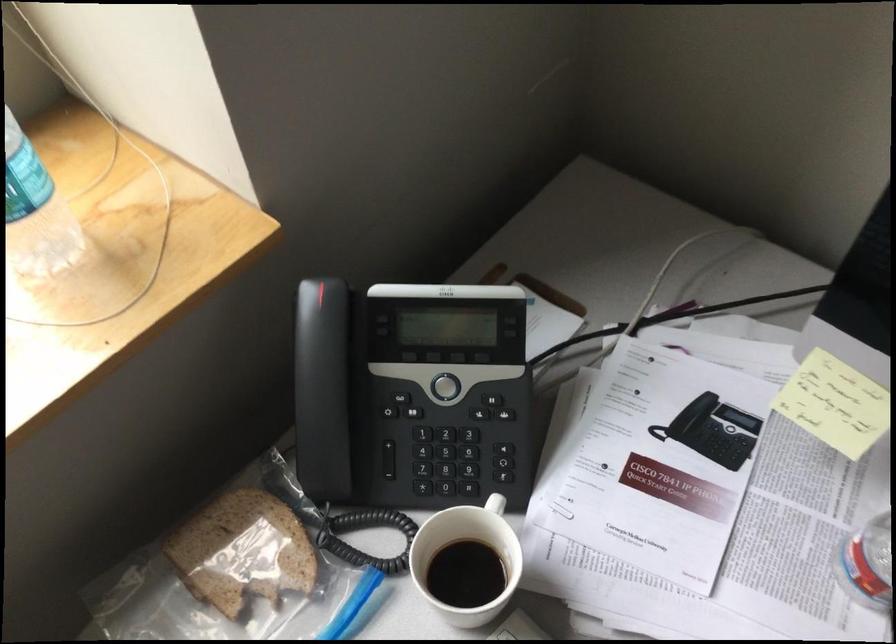
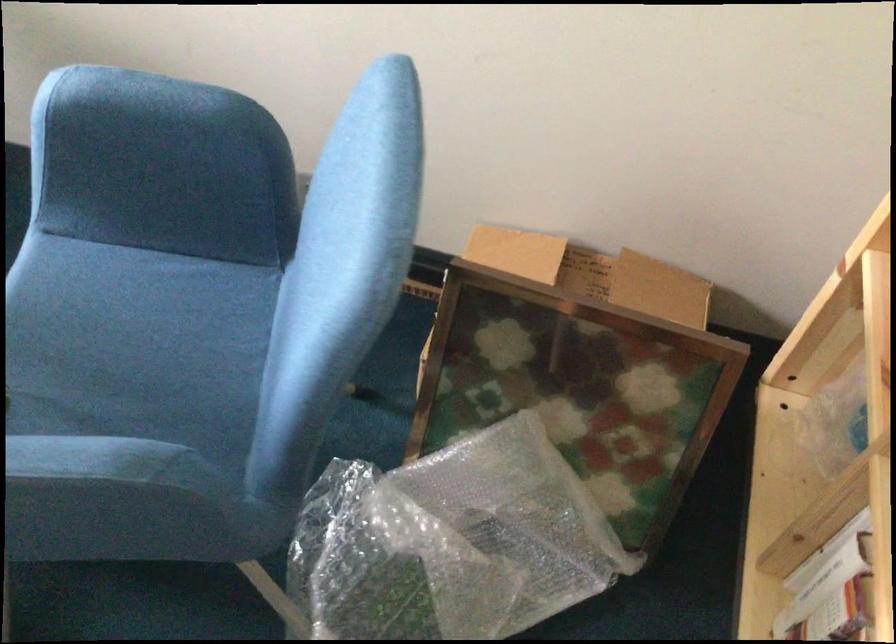
In a continuous first-person perspective shot, in which direction is the camera moving?

The cameraman moved toward right, backward.